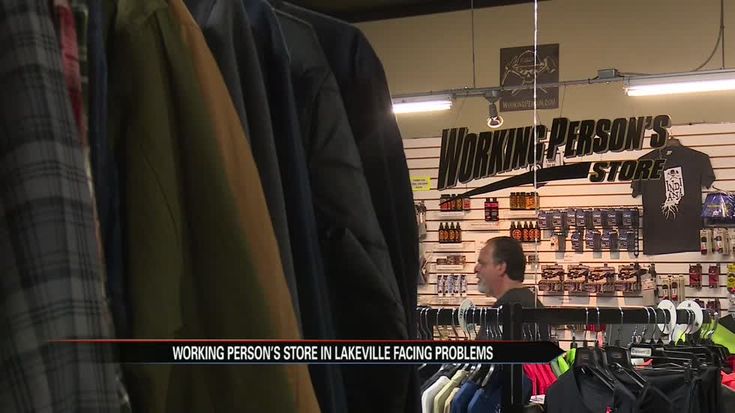
I want to click on metal back bar for hanging clothes, so click(588, 321).